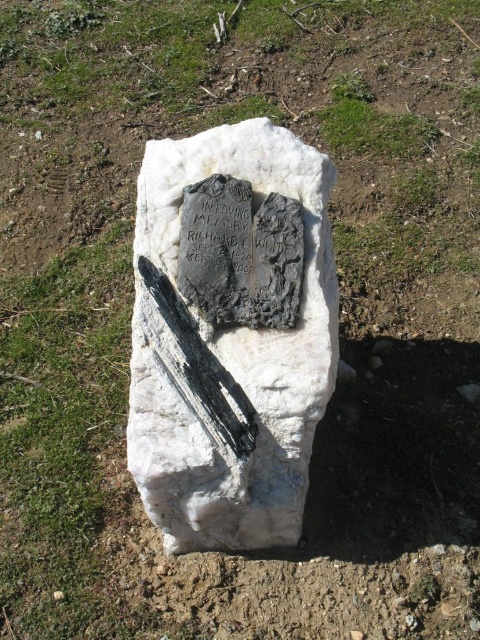
Question: Which point is farther to the camera?

Choices:
 (A) white marble stone at center
 (B) black polished blade at center

Answer: (A)

Question: Is white marble stone at center further to camera compared to black polished blade at center?

Choices:
 (A) yes
 (B) no

Answer: (A)

Question: Among these objects, which one is nearest to the camera?

Choices:
 (A) white marble stone at center
 (B) black polished blade at center

Answer: (B)

Question: Is white marble stone at center wider than black polished blade at center?

Choices:
 (A) no
 (B) yes

Answer: (B)

Question: Where is white marble stone at center located in relation to black polished blade at center in the image?

Choices:
 (A) above
 (B) below

Answer: (A)